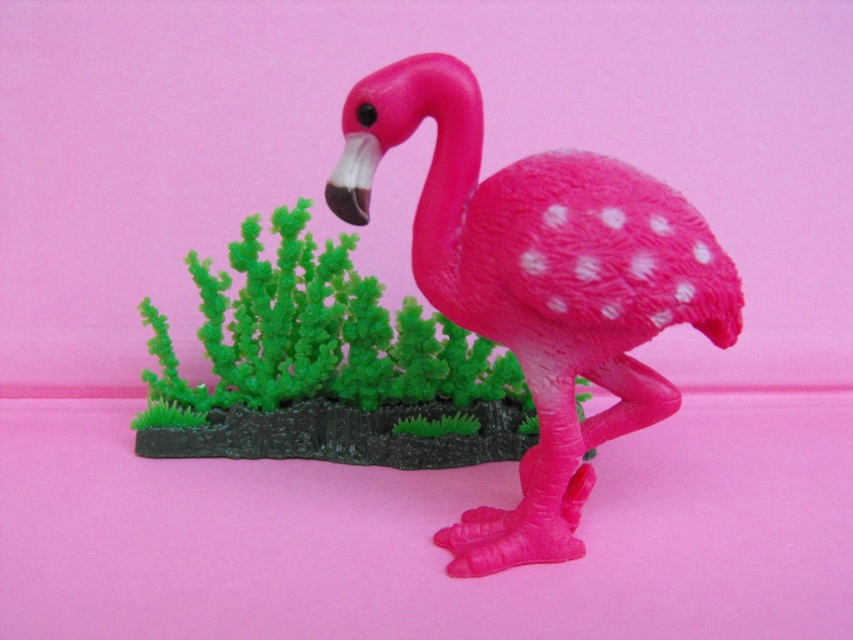
You are a photographer trying to capture the matte plastic flamingo at center and the green matte plant at center in a single shot. Which object will appear larger in your photo?

The matte plastic flamingo at center will appear larger in the photo because it is closer to the viewer than the green matte plant at center.

You are setting up a display for a nature exhibit. You have a matte plastic flamingo at center and a green matte plant at center. Which object should you place first if you want the larger item to be the focal point of the display?

You should place the matte plastic flamingo at center first because it is larger than the green matte plant at center, making it the focal point.

You are standing in front of the image and want to know how far the point at coordinates point (590, 227) is from your eyes. Can you determine the distance?

The point at coordinates point (590, 227) is 1.10 meters from the camera, so the distance from your eyes would depend on how far you are standing from the image. If you are standing at the camera position, the distance would be 1.10 meters.